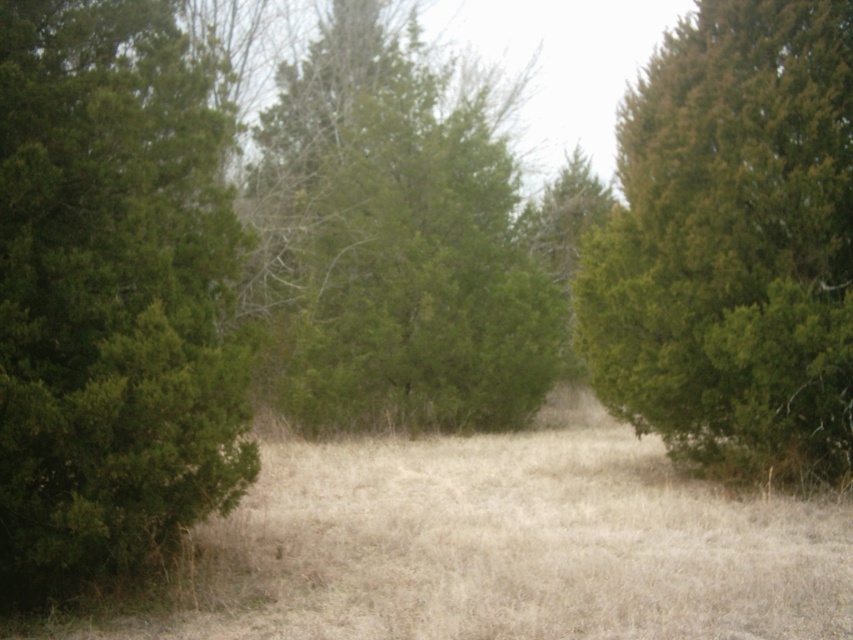
Question: Is the position of green matte tree at left more distant than that of green matte tree at right?

Choices:
 (A) yes
 (B) no

Answer: (B)

Question: Does dry grass at center appear on the right side of green matte tree at center?

Choices:
 (A) no
 (B) yes

Answer: (B)

Question: Is the position of green matte tree at left more distant than that of dry grass at center?

Choices:
 (A) no
 (B) yes

Answer: (A)

Question: Which of the following is the farthest from the observer?

Choices:
 (A) (593, 262)
 (B) (91, 620)
 (C) (143, 480)
 (D) (537, 348)

Answer: (D)

Question: Which object is farther from the camera taking this photo?

Choices:
 (A) green matte tree at center
 (B) green matte tree at left
 (C) green matte tree at right

Answer: (A)

Question: Which point is farther to the camera?

Choices:
 (A) green matte tree at left
 (B) green matte tree at right
 (C) dry grass at center
 (D) green matte tree at center

Answer: (D)